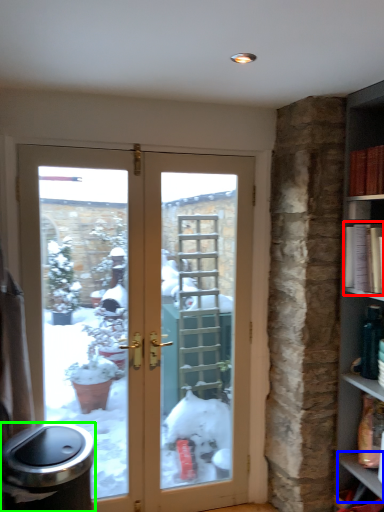
Question: Based on their relative distances, which object is nearer to book (highlighted by a red box)? Choose from window sill (highlighted by a blue box) and garbage (highlighted by a green box).

Choices:
 (A) window sill
 (B) garbage

Answer: (A)